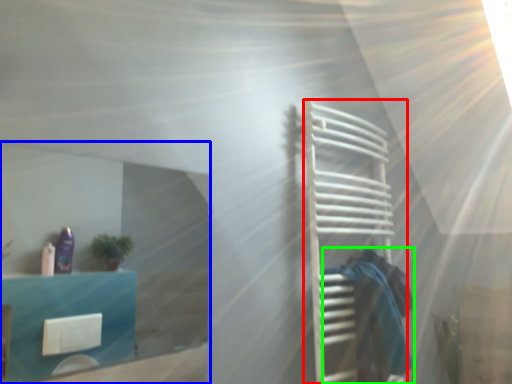
Question: Considering the real-world distances, which object is farthest from cage (highlighted by a red box)? glass door (highlighted by a blue box) or person (highlighted by a green box)?

Choices:
 (A) glass door
 (B) person

Answer: (A)